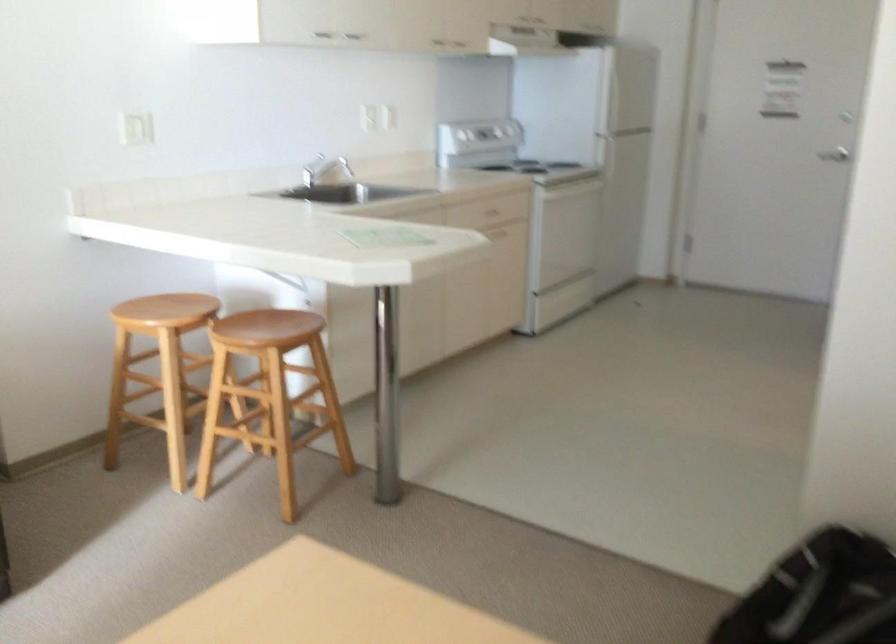
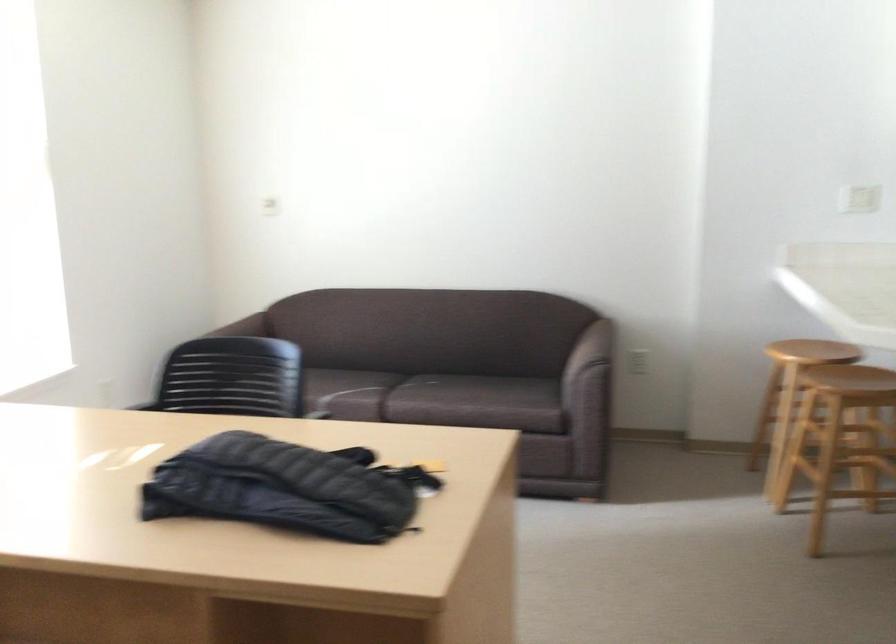
Find the pixel in the second image that matches the point at 286,427 in the first image.

(837, 466)